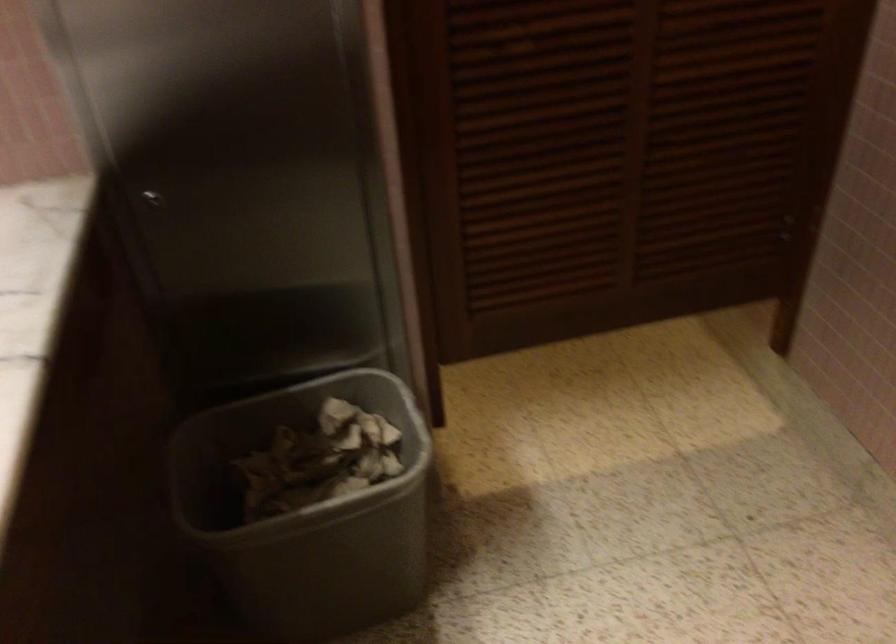
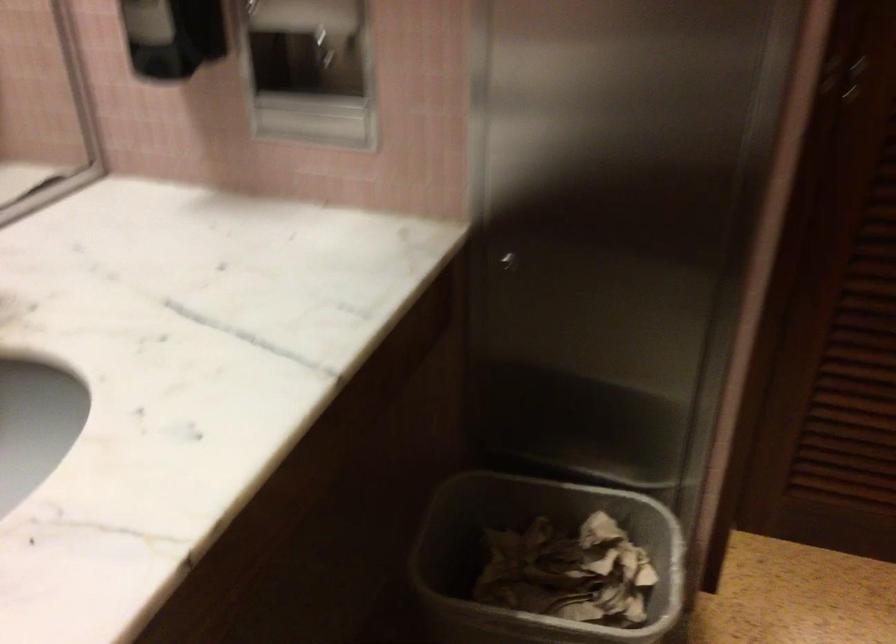
Find the pixel in the second image that matches pixel 287 469 in the first image.

(533, 558)